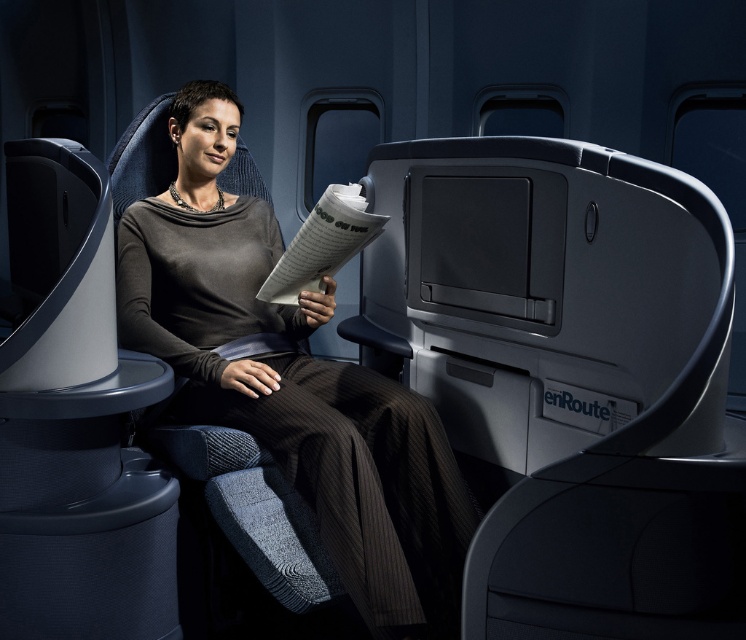
Question: Which point is farther from the camera taking this photo?

Choices:
 (A) (275, 298)
 (B) (319, 401)

Answer: (A)

Question: Which point appears closest to the camera in this image?

Choices:
 (A) pos(291,253)
 (B) pos(316,324)

Answer: (A)

Question: Can you confirm if matte gray sweater at center is smaller than white paper at center?

Choices:
 (A) yes
 (B) no

Answer: (B)

Question: Can you confirm if matte gray sweater at center is positioned above white paper at center?

Choices:
 (A) yes
 (B) no

Answer: (B)

Question: Can you confirm if matte gray sweater at center is thinner than white paper at center?

Choices:
 (A) yes
 (B) no

Answer: (B)

Question: Which point is farther to the camera?

Choices:
 (A) (307, 284)
 (B) (236, 257)

Answer: (B)